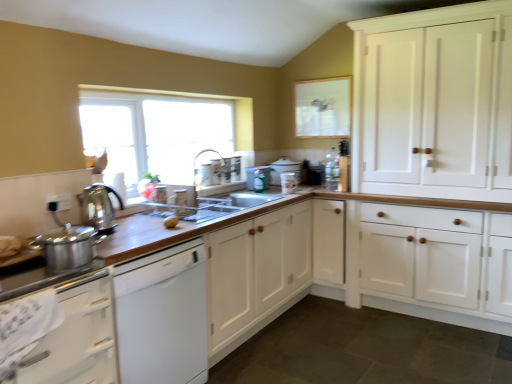
Consider the image. In order to face yellow matte potato at center, should I rotate leftwards or rightwards?

You should look left and rotate roughly 11.168 degrees.

The image size is (512, 384). I want to click on clear glass window at upper center, so click(159, 129).

Identify the location of matte white pot at center, which appears as the 5th appliance when viewed from the front. (284, 169).

You are a GUI agent. You are given a task and a screenshot of the screen. Output one action in this format:
    pyautogui.click(x=<x>, y=<y>)
    Task: Click on the shiny metallic pot at left
    Image resolution: width=512 pixels, height=384 pixels.
    Given the screenshot: What is the action you would take?
    pyautogui.click(x=67, y=247)

This screenshot has height=384, width=512. Find the location of `yellow matte potato at center`. yellow matte potato at center is located at coordinates (170, 222).

Between wooden at left and white glossy dishwasher at lower left, the third cabinetry in the right-to-left sequence, which one is positioned behind?

wooden at left is further from the camera.

Does point (485, 238) appear closer or farther from the camera than point (89, 380)?

Point (485, 238) is farther from the camera than point (89, 380).

In the scene shown: Who is taller, wooden at left or white glossy dishwasher at lower left, the third cabinetry in the right-to-left sequence?

wooden at left.

Considering the relative sizes of wooden at left and white glossy dishwasher at lower left, the third cabinetry in the right-to-left sequence, in the image provided, is wooden at left thinner than white glossy dishwasher at lower left, the third cabinetry in the right-to-left sequence,?

Incorrect, the width of wooden at left is not less than that of white glossy dishwasher at lower left, the third cabinetry in the right-to-left sequence.

From the image's perspective, starting from the clear glass window at upper center, which cabinetry is the 2nd one below? Please provide its 2D coordinates.

[(256, 274)]

From the image's perspective, is clear glass window at upper center on top of white wood cabinet at center, the 2th cabinetry from the left?

Indeed, from the image's perspective, clear glass window at upper center is shown above white wood cabinet at center, the 2th cabinetry from the left.

Is clear glass window at upper center positioned before white wood cabinet at center, the 2th cabinetry from the left?

No.

Which is closer to the camera, (x=129, y=149) or (x=223, y=239)?

Clearly, point (x=129, y=149) is more distant from the camera than point (x=223, y=239).

Can you confirm if white glossy dishwasher at lower left, positioned as the first cabinetry in left-to-right order, is thinner than yellow matte potato at center?

No, white glossy dishwasher at lower left, positioned as the first cabinetry in left-to-right order, is not thinner than yellow matte potato at center.

Between point (106, 373) and point (165, 222), which one is positioned behind?

The point (165, 222) is farther.

Is white glossy dishwasher at lower left, positioned as the first cabinetry in left-to-right order, positioned with its back to yellow matte potato at center?

white glossy dishwasher at lower left, positioned as the first cabinetry in left-to-right order, does not have its back to yellow matte potato at center.

Is white glossy dishwasher at lower left, positioned as the first cabinetry in left-to-right order, situated inside yellow matte potato at center or outside?

white glossy dishwasher at lower left, positioned as the first cabinetry in left-to-right order, is spatially situated outside yellow matte potato at center.

From a real-world perspective, which is physically below, yellow matte potato at center or satin silver kettle at left, positioned as the 1th appliance in front-to-back order?

From a 3D spatial view, yellow matte potato at center is below.

Is yellow matte potato at center turned away from satin silver kettle at left, positioned as the 1th appliance in front-to-back order?

No, yellow matte potato at center's orientation is not away from satin silver kettle at left, positioned as the 1th appliance in front-to-back order.

Looking at this image, is yellow matte potato at center spatially inside satin silver kettle at left, positioned as the 6th appliance in right-to-left order, or outside of it?

yellow matte potato at center is located beyond the bounds of satin silver kettle at left, positioned as the 6th appliance in right-to-left order.

Is yellow matte potato at center placed right next to satin silver kettle at left, acting as the 6th appliance starting from the back?

No, yellow matte potato at center is not in contact with satin silver kettle at left, acting as the 6th appliance starting from the back.

From the picture: Considering the relative sizes of silver metallic faucet at upper center and matte white pot at center, marked as the fourth appliance in a left-to-right arrangement, in the image provided, is silver metallic faucet at upper center wider than matte white pot at center, marked as the fourth appliance in a left-to-right arrangement,?

No, silver metallic faucet at upper center is not wider than matte white pot at center, marked as the fourth appliance in a left-to-right arrangement.

Is the depth of silver metallic faucet at upper center greater than that of matte white pot at center, the second appliance viewed from the back?

No, silver metallic faucet at upper center is in front of matte white pot at center, the second appliance viewed from the back.

How distant is silver metallic faucet at upper center from matte white pot at center, the second appliance viewed from the back?

A distance of 20.76 inches exists between silver metallic faucet at upper center and matte white pot at center, the second appliance viewed from the back.

Is silver metallic faucet at upper center bigger than matte white pot at center, marked as the fourth appliance in a left-to-right arrangement?

Actually, silver metallic faucet at upper center might be smaller than matte white pot at center, marked as the fourth appliance in a left-to-right arrangement.

In the image, is metallic silver spray bottle at center, the 3th appliance positioned from the left, positioned in front of or behind wooden at left?

metallic silver spray bottle at center, the 3th appliance positioned from the left, is positioned farther from the viewer than wooden at left.

Considering the sizes of objects metallic silver spray bottle at center, acting as the fourth appliance starting from the right, and wooden at left in the image provided, who is wider, metallic silver spray bottle at center, acting as the fourth appliance starting from the right, or wooden at left?

wooden at left is wider.

Is there a large distance between metallic silver spray bottle at center, the 3th appliance positioned from the left, and wooden at left?

No, metallic silver spray bottle at center, the 3th appliance positioned from the left, is in close proximity to wooden at left.

From the image's perspective, is metallic silver spray bottle at center, which is counted as the 4th appliance, starting from the front, located above or below wooden at left?

metallic silver spray bottle at center, which is counted as the 4th appliance, starting from the front, is situated higher than wooden at left in the image.

Is metallic silver spray bottle at center, the 3th appliance positioned from the left, at the back of clear glass window at upper center?

No, metallic silver spray bottle at center, the 3th appliance positioned from the left, is not at the back of clear glass window at upper center.

Which of these two, clear glass window at upper center or metallic silver spray bottle at center, which is counted as the 4th appliance, starting from the front, stands taller?

Standing taller between the two is clear glass window at upper center.

Locate an element on the screen. the 2nd cabinetry counting from the left side of the wooden at left is located at coordinates (77, 337).

The height and width of the screenshot is (384, 512). There is a clear glass window at upper center. Find the location of `the 2nd cabinetry below it (from the image's perspective)`. the 2nd cabinetry below it (from the image's perspective) is located at coordinates (256, 274).

Based on their spatial positions, is wooden at left or matte white mug at upper center, marked as the 2th appliance in a right-to-left arrangement, further from clear glass window screen at upper center?

The object further to clear glass window screen at upper center is wooden at left.

From the image, which object appears to be nearer to metallic silver spray bottle at center, acting as the fourth appliance starting from the right, yellow matte potato at center or shiny metallic pot at left?

yellow matte potato at center lies closer to metallic silver spray bottle at center, acting as the fourth appliance starting from the right, than the other object.

From the image, which object appears to be farther from clear plastic dish rack at center, the fifth appliance from the back, silver metallic faucet at upper center or yellow matte potato at center?

Among the two, silver metallic faucet at upper center is located further to clear plastic dish rack at center, the fifth appliance from the back.

Looking at the image, which one is located further to clear glass window screen at upper center, wooden at left or matte white pot at center, the second appliance viewed from the back?

wooden at left lies further to clear glass window screen at upper center than the other object.

Consider the image. Based on their spatial positions, is white wood cabinets at right, acting as the first cabinetry starting from the right, or metallic silver spray bottle at center, which is counted as the 3th appliance, starting from the back, further from satin silver kettle at left, acting as the 6th appliance starting from the back?

The object further to satin silver kettle at left, acting as the 6th appliance starting from the back, is white wood cabinets at right, acting as the first cabinetry starting from the right.

Looking at the image, which one is located further to shiny metallic pot at left, wooden at left or matte white pot at center, acting as the third appliance starting from the right?

Based on the image, wooden at left appears to be further to shiny metallic pot at left.

Based on their spatial positions, is white wood cabinet at center, the 2th cabinetry from the left, or wooden at left closer to yellow matte potato at center?

Based on the image, white wood cabinet at center, the 2th cabinetry from the left, appears to be nearer to yellow matte potato at center.

Looking at this image, looking at the image, which one is located further to clear plastic dish rack at center, marked as the 2th appliance in a left-to-right arrangement, metallic silver spray bottle at center, acting as the fourth appliance starting from the right, or clear glass window screen at upper center?

clear glass window screen at upper center lies further to clear plastic dish rack at center, marked as the 2th appliance in a left-to-right arrangement, than the other object.

I want to click on window located between wooden at left and silver metallic faucet at upper center in the depth direction, so click(159, 129).

Where is `appliance between clear glass window at upper center and metallic silver spray bottle at center, which is counted as the 4th appliance, starting from the front, in the front-back direction`? appliance between clear glass window at upper center and metallic silver spray bottle at center, which is counted as the 4th appliance, starting from the front, in the front-back direction is located at coordinates point(288,182).

Where is `food that lies between clear glass window at upper center and wooden at left from top to bottom`? This screenshot has height=384, width=512. food that lies between clear glass window at upper center and wooden at left from top to bottom is located at coordinates (170, 222).

The width and height of the screenshot is (512, 384). Identify the location of window screen positioned between white wood cabinets at right, the 3th cabinetry viewed from the left, and black plastic toaster at upper center, the 6th appliance when ordered from front to back, from near to far. (323, 108).